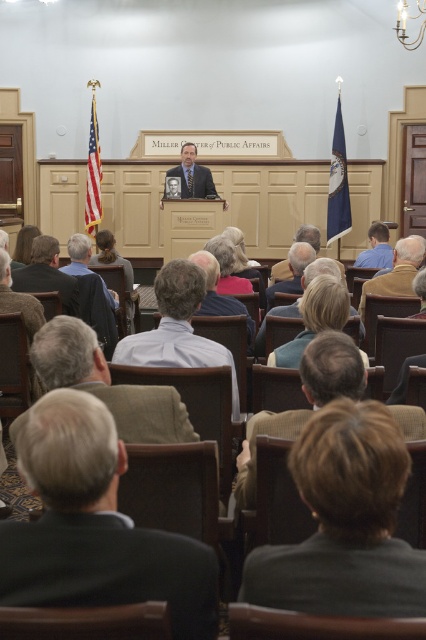
Who is taller, light brown leather jacket at center or gray hair at center?

light brown leather jacket at center

Is point (244, 310) positioned after point (290, 272)?

No.

Identify the location of light brown leather jacket at center. The image size is (426, 640). (218, 294).

Who is positioned more to the left, brown leather chair at lower center or gray hair at center?

brown leather chair at lower center

Does brown leather chair at lower center come behind gray hair at center?

No, it is in front of gray hair at center.

The image size is (426, 640). What are the coordinates of `brown leather chair at lower center` in the screenshot? It's located at (316, 625).

Can you confirm if brown hair at lower right is taller than dark wood chair at lower left?

Yes, brown hair at lower right is taller than dark wood chair at lower left.

Between brown hair at lower right and dark wood chair at lower left, which one appears on the right side from the viewer's perspective?

Positioned to the right is brown hair at lower right.

Who is more forward, (267, 593) or (138, 627)?

Positioned in front is point (138, 627).

You are a GUI agent. You are given a task and a screenshot of the screen. Output one action in this format:
    pyautogui.click(x=<x>, y=<y>)
    Task: Click on the brown hair at lower right
    The width and height of the screenshot is (426, 640).
    Given the screenshot: What is the action you would take?
    pyautogui.click(x=345, y=522)